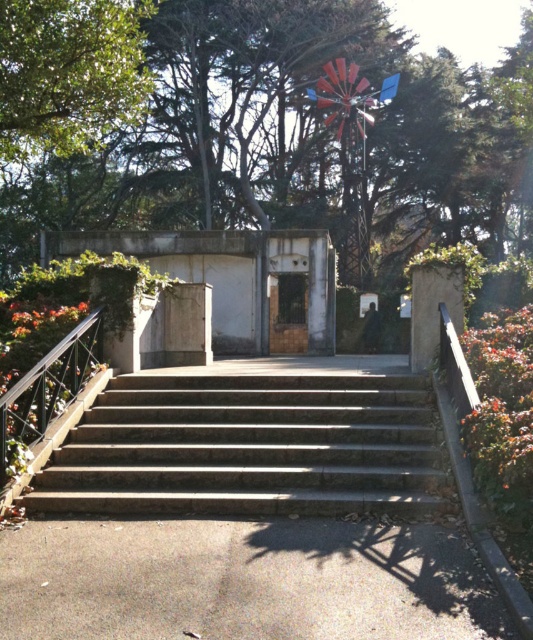
You are a delivery person trying to reach the wooden door at center. The slate stone stairs at center are in your way. Can you walk around them to reach the door?

The slate stone stairs at center is in front of wooden door at center, so you cannot walk around them directly. You must go up the stairs to reach the wooden door at center.